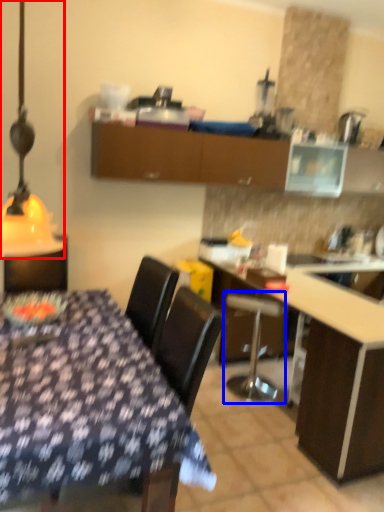
Question: Among these objects, which one is farthest to the camera, table lamp (highlighted by a red box) or bar stool (highlighted by a blue box)?

Choices:
 (A) table lamp
 (B) bar stool

Answer: (B)